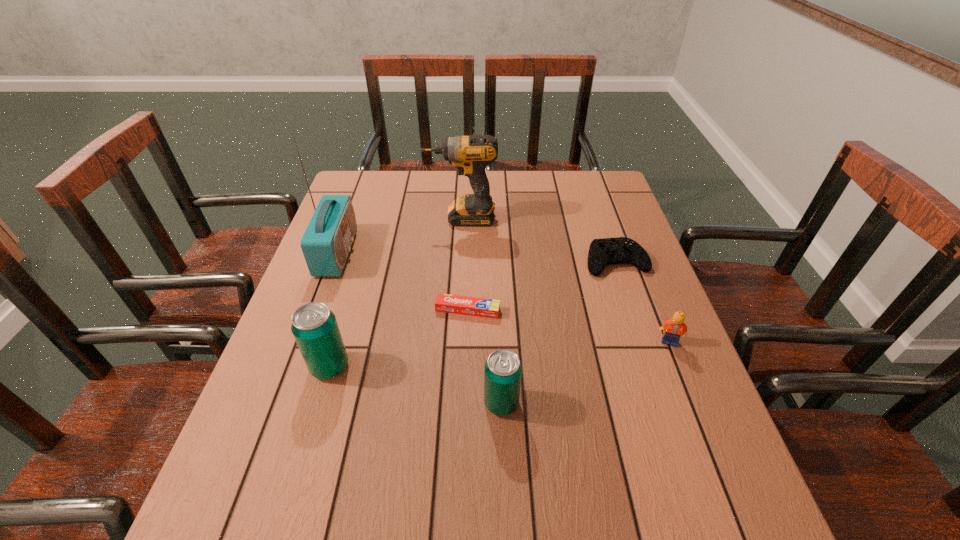
I want to click on free location located 0.150m on the left of the fourth nearest object, so click(x=374, y=310).

This screenshot has width=960, height=540. Find the location of `object located in the far edge section of the desktop`. object located in the far edge section of the desktop is located at coordinates (471, 154).

Locate an element on the screen. The width and height of the screenshot is (960, 540). beer can that is positioned at the left edge is located at coordinates (314, 326).

In order to click on radio receiver that is at the left edge in this screenshot , I will do [326, 243].

In order to click on Lego located in the right edge section of the desktop in this screenshot , I will do `click(675, 328)`.

Locate an element on the screen. control that is positioned at the right edge is located at coordinates (621, 250).

The width and height of the screenshot is (960, 540). In the image, there is a desktop. What are the coordinates of `vacant space at the far edge` in the screenshot? It's located at (502, 170).

In the image, there is a desktop. Where is `vacant space at the near edge`? The height and width of the screenshot is (540, 960). vacant space at the near edge is located at coordinates (508, 474).

Find the location of a particular element. This screenshot has width=960, height=540. vacant space at the left edge is located at coordinates (272, 410).

Identify the location of free region at the right edge of the desktop. Image resolution: width=960 pixels, height=540 pixels. (632, 278).